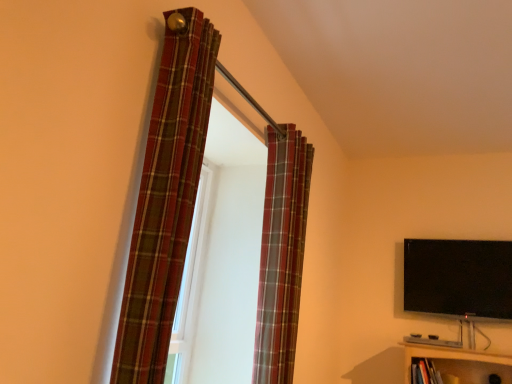
Question: Is black glossy flat-screen tv at upper right located outside plaid fabric curtain at upper center, the first curtain viewed from the back?

Choices:
 (A) no
 (B) yes

Answer: (B)

Question: Is black glossy flat-screen tv at upper right not close to plaid fabric curtain at upper center, which is the second curtain from left to right?

Choices:
 (A) yes
 (B) no

Answer: (A)

Question: Does black glossy flat-screen tv at upper right have a greater height compared to plaid fabric curtain at upper center, which is the second curtain from left to right?

Choices:
 (A) no
 (B) yes

Answer: (A)

Question: From the image's perspective, is black glossy flat-screen tv at upper right located beneath plaid fabric curtain at upper center, which is the second curtain from left to right?

Choices:
 (A) no
 (B) yes

Answer: (B)

Question: Does black glossy flat-screen tv at upper right appear on the right side of plaid fabric curtain at upper center, the first curtain viewed from the back?

Choices:
 (A) no
 (B) yes

Answer: (B)

Question: Is plaid fabric curtain at left, placed as the 2th curtain when sorted from right to left, in front of or behind black glossy flat-screen tv at upper right in the image?

Choices:
 (A) behind
 (B) front

Answer: (B)

Question: Is point (197, 64) positioned closer to the camera than point (444, 283)?

Choices:
 (A) closer
 (B) farther

Answer: (A)

Question: From a real-world perspective, is plaid fabric curtain at left, positioned as the second curtain in back-to-front order, positioned above or below black glossy flat-screen tv at upper right?

Choices:
 (A) below
 (B) above

Answer: (A)

Question: Would you say plaid fabric curtain at left, positioned as the second curtain in back-to-front order, is to the left or to the right of black glossy flat-screen tv at upper right in the picture?

Choices:
 (A) right
 (B) left

Answer: (B)

Question: Based on their positions, is plaid fabric curtain at upper center, the first curtain viewed from the back, located to the left or right of plaid fabric curtain at left, the 1th curtain in the front-to-back sequence?

Choices:
 (A) right
 (B) left

Answer: (A)

Question: From the image's perspective, relative to plaid fabric curtain at left, positioned as the second curtain in back-to-front order, is plaid fabric curtain at upper center, which is the second curtain from left to right, above or below?

Choices:
 (A) below
 (B) above

Answer: (A)

Question: Considering the positions of plaid fabric curtain at upper center, the 2th curtain viewed from the front, and plaid fabric curtain at left, the 1th curtain in the front-to-back sequence, in the image, is plaid fabric curtain at upper center, the 2th curtain viewed from the front, bigger or smaller than plaid fabric curtain at left, the 1th curtain in the front-to-back sequence,?

Choices:
 (A) small
 (B) big

Answer: (B)

Question: Is plaid fabric curtain at upper center, the 2th curtain viewed from the front, inside the boundaries of plaid fabric curtain at left, placed as the 2th curtain when sorted from right to left, or outside?

Choices:
 (A) inside
 (B) outside

Answer: (B)

Question: Relative to plaid fabric curtain at upper center, the 2th curtain viewed from the front, is black glossy flat-screen tv at upper right in front or behind?

Choices:
 (A) front
 (B) behind

Answer: (B)

Question: Choose the correct answer: Is black glossy flat-screen tv at upper right inside plaid fabric curtain at upper center, which is the second curtain from left to right, or outside it?

Choices:
 (A) outside
 (B) inside

Answer: (A)